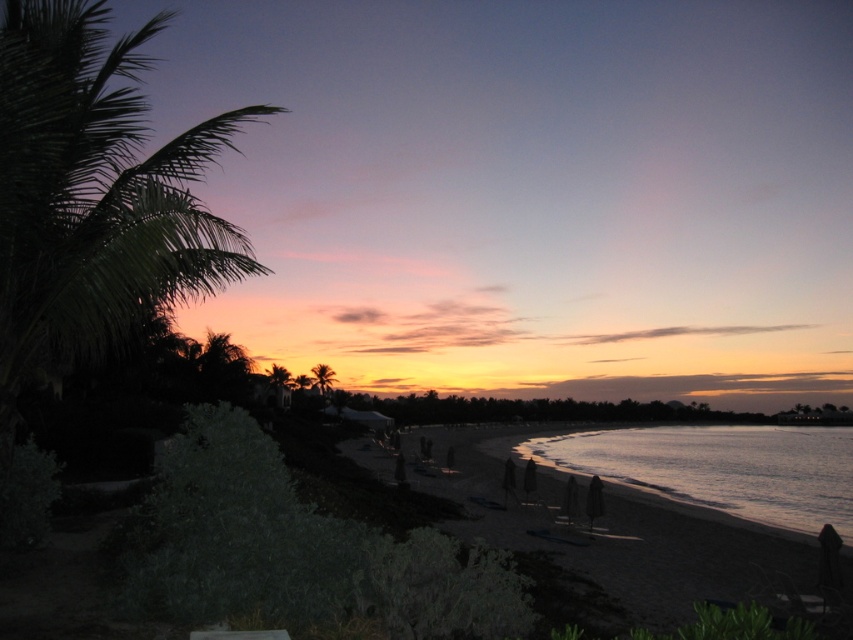
Question: Is green leafy palm tree at left closer to the viewer compared to smooth sand beach at lower right?

Choices:
 (A) no
 (B) yes

Answer: (B)

Question: Does green leafy palm tree at left appear under silvery reflective water at lower right?

Choices:
 (A) yes
 (B) no

Answer: (B)

Question: Among these points, which one is farthest from the camera?

Choices:
 (A) (701, 577)
 (B) (94, 317)

Answer: (A)

Question: Which point is closer to the camera taking this photo?

Choices:
 (A) (816, 502)
 (B) (7, 80)

Answer: (B)

Question: Where is smooth sand beach at lower right located in relation to green leafy palm tree at center in the image?

Choices:
 (A) right
 (B) left

Answer: (A)

Question: Which is nearer to the silvery reflective water at lower right?

Choices:
 (A) green leafy palm tree at center
 (B) smooth sand beach at lower right
 (C) green leafy palm tree at left

Answer: (B)